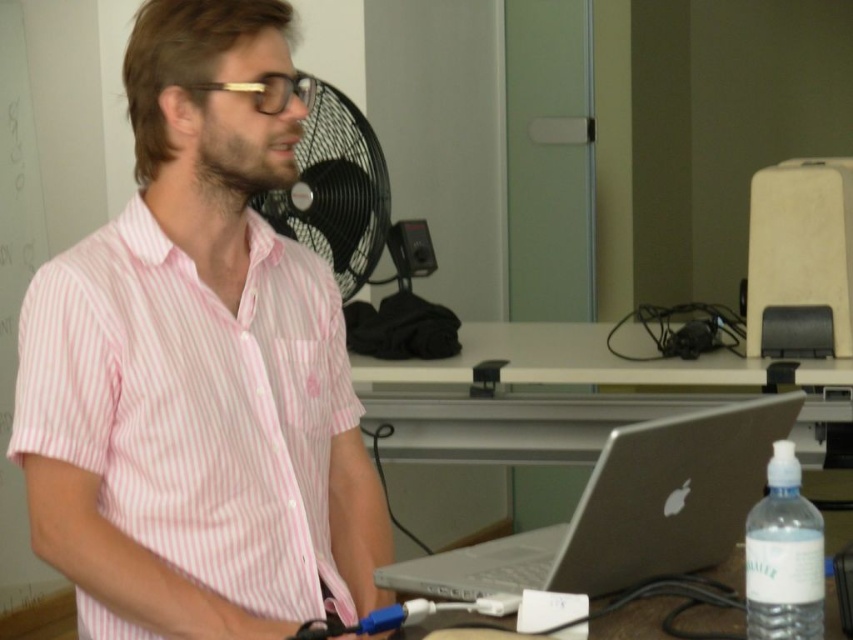
You are organizing a desk and need to place the black plastic fan at center and the clear plastic bottle at lower right. If you want to place a small decorative item between them, which object should the item be placed closer to?

The black plastic fan at center is larger in size than the clear plastic bottle at lower right, so the small decorative item should be placed closer to the clear plastic bottle at lower right to balance the space.

You are a photographer setting up for a portrait shoot. The subject is wearing a pink striped shirt at center and there is a clear plastic bottle at lower right on the desk. To ensure both are in frame, where should you position the camera relative to the subject?

The pink striped shirt at center is to the left of the clear plastic bottle at lower right, so positioning the camera to the left side of the subject will keep both the pink striped shirt at center and the clear plastic bottle at lower right within the frame.

You are a photographer taking a picture of the scene. The pink striped shirt at center and the clear plastic bottle at lower right are in your frame. Which object is closer to the camera?

The pink striped shirt at center is above the clear plastic bottle at lower right, so it is closer to the camera.